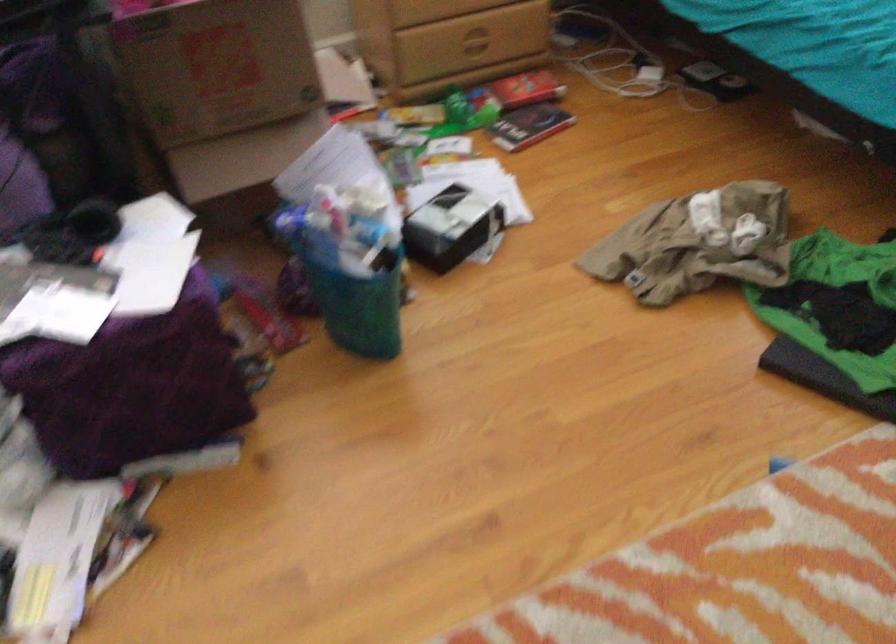
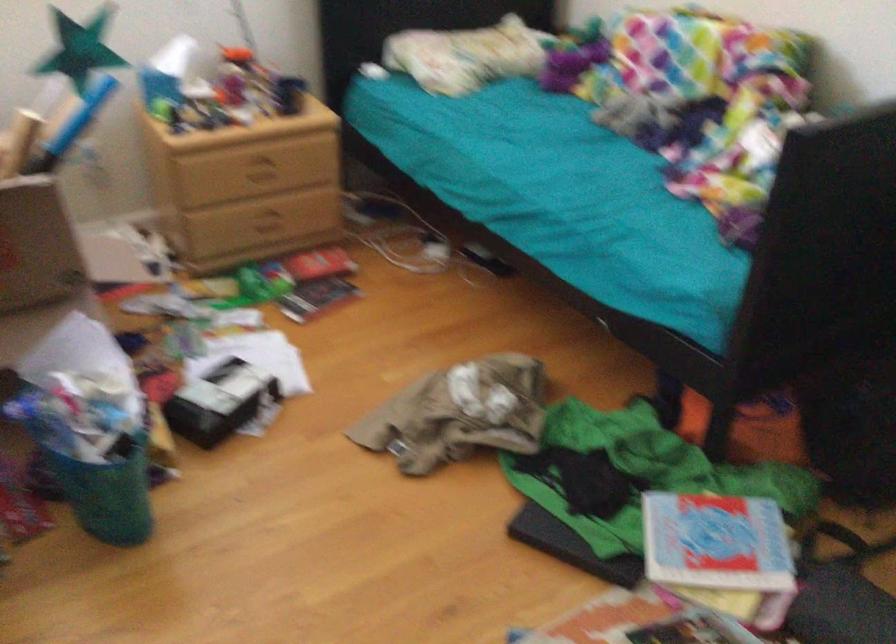
Locate, in the second image, the point that corresponds to pixel 704 79 in the first image.

(481, 259)